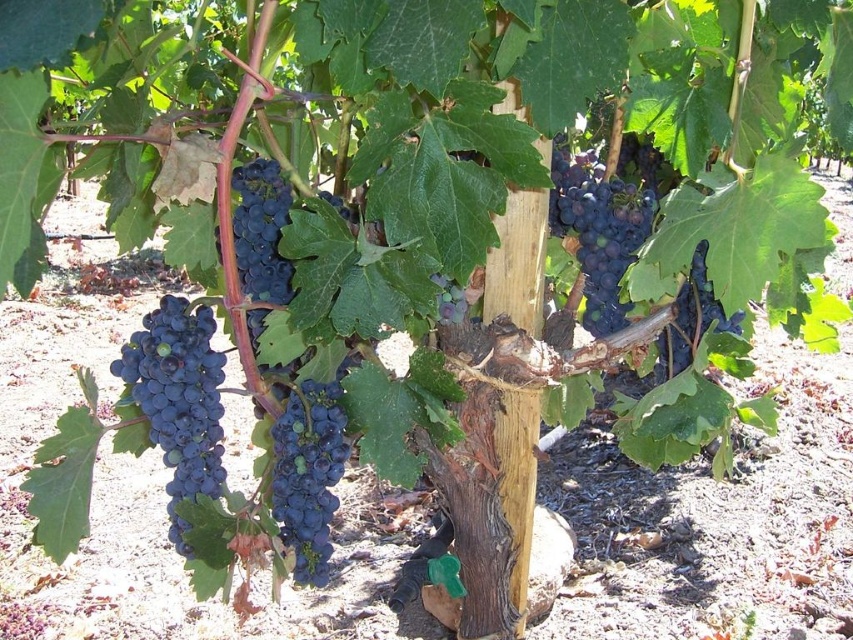
Which of these two, shiny purple grapes at center or purple matte grapes at center, stands taller?

Standing taller between the two is shiny purple grapes at center.

Is shiny purple grapes at center to the right of purple matte grapes at center from the viewer's perspective?

Correct, you'll find shiny purple grapes at center to the right of purple matte grapes at center.

Who is more forward, [682,346] or [456,307]?

Point [456,307] is in front.

The image size is (853, 640). In order to click on shiny purple grapes at center in this screenshot , I will do `click(692, 317)`.

Is shiny dark purple grapes at center above shiny purple grapes at center?

Correct, shiny dark purple grapes at center is located above shiny purple grapes at center.

Does point (606, 224) come farther from viewer compared to point (683, 358)?

No, it is not.

Is point (622, 252) behind point (676, 348)?

No, it is not.

Identify the location of shiny dark purple grapes at center. This screenshot has height=640, width=853. (602, 221).

Who is lower down, shiny dark purple grapes at left or shiny dark purple grapes at center?

shiny dark purple grapes at left is below.

Does shiny dark purple grapes at left have a lesser width compared to shiny dark purple grapes at center?

Correct, shiny dark purple grapes at left's width is less than shiny dark purple grapes at center's.

Who is more forward, [157,378] or [556,198]?

Positioned in front is point [157,378].

Find the location of `shiny dark purple grapes at left`. shiny dark purple grapes at left is located at coordinates (178, 400).